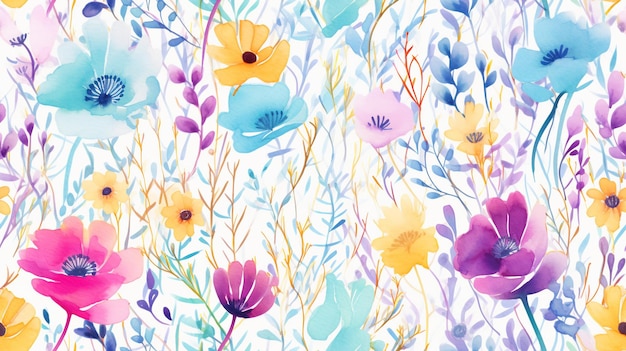
Identify the location of flowers on the right. (553, 52), (523, 231), (610, 186), (598, 305).